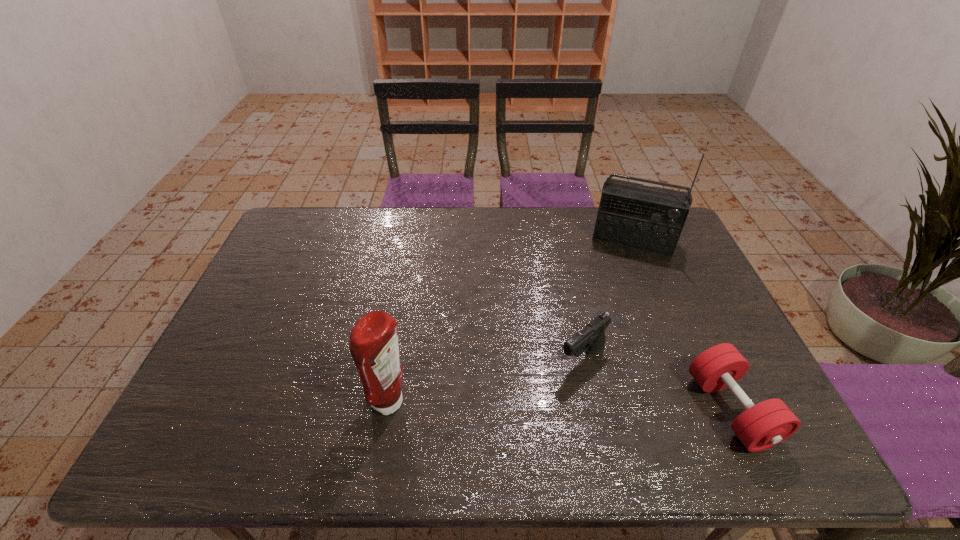
Where is `vacant spot on the desktop that is between the condiment and the dumbbell and is positioned at the barrel of the pistol`? This screenshot has height=540, width=960. vacant spot on the desktop that is between the condiment and the dumbbell and is positioned at the barrel of the pistol is located at coordinates (527, 406).

Locate an element on the screen. free spot on the desktop that is between the third shortest object and the dumbbell and is positioned on the front panel of the radio receiver is located at coordinates (x=596, y=407).